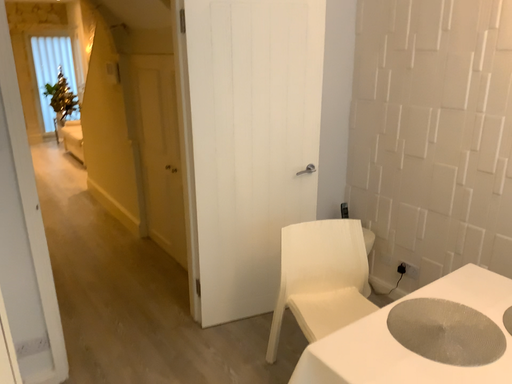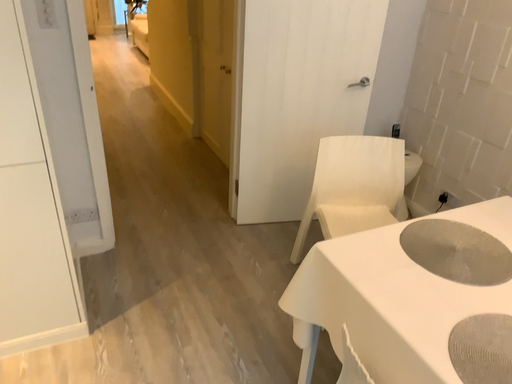
Question: Which way did the camera rotate in the video?

Choices:
 (A) rotated left
 (B) rotated right

Answer: (A)